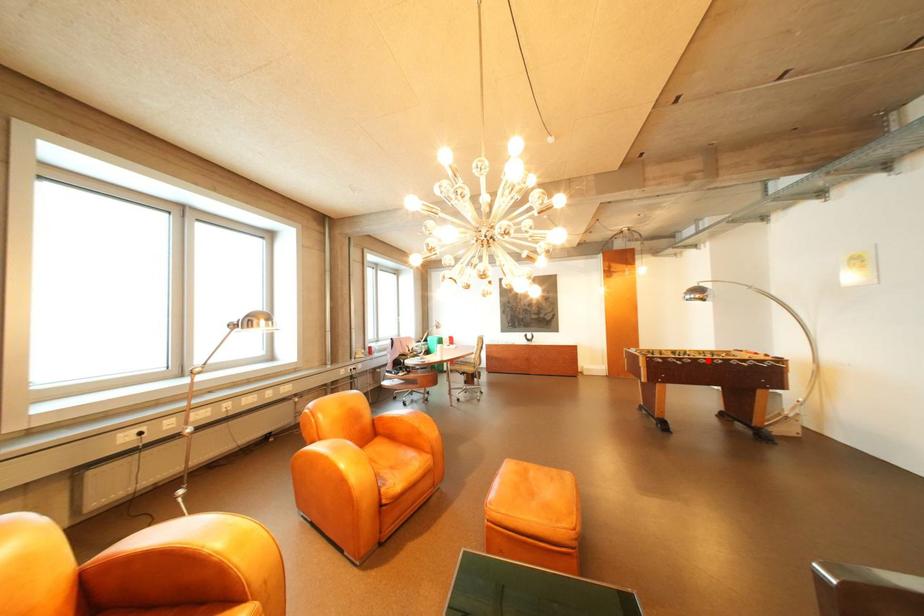
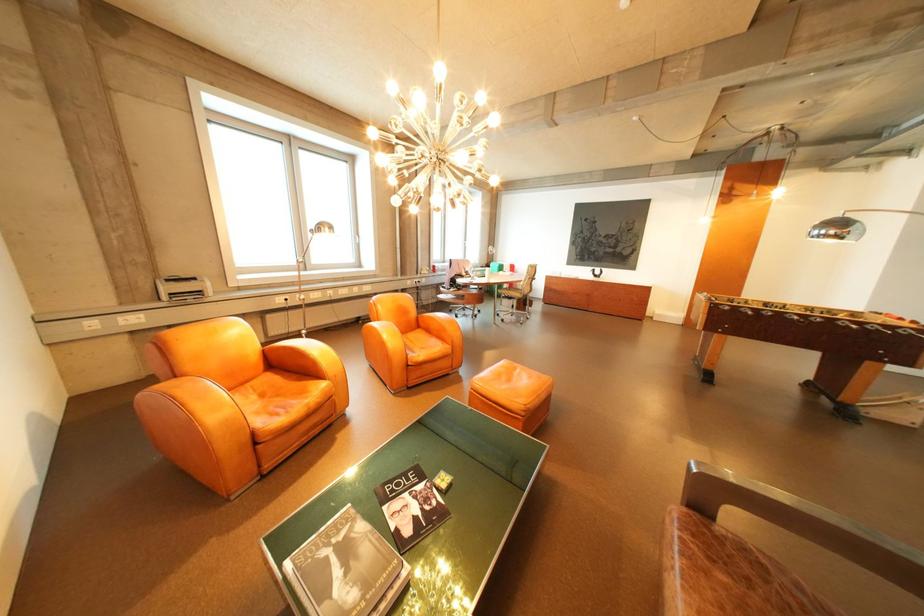
Where in the second image is the point corresponding to the highlighted location from the first image?

(794, 314)